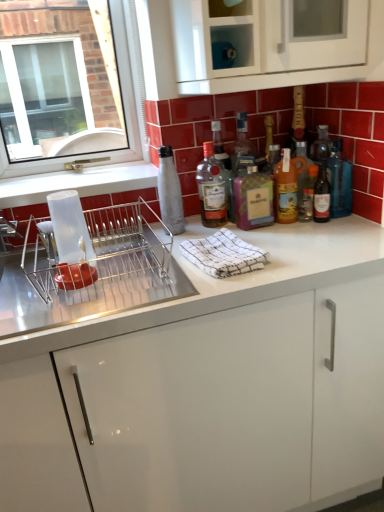
Describe the element at coordinates (223, 254) in the screenshot. This screenshot has height=512, width=384. I see `white textured cloth at center` at that location.

At what (x,y) coordinates should I click in order to perform the action: click on matte glass wine bottle at center-right. Please return your answer as a coordinate pair (x, y). This screenshot has height=512, width=384. Looking at the image, I should click on (321, 196).

How much space does translucent amber bottle at center, which appears as the fourth bottle when viewed from the left, occupy vertically?

translucent amber bottle at center, which appears as the fourth bottle when viewed from the left, is 8.98 inches in height.

Where is `white textured cloth at center`? Image resolution: width=384 pixels, height=512 pixels. white textured cloth at center is located at coordinates (223, 254).

Could you tell me if matte glass bottle at center, the 2th bottle positioned from the left, is turned towards matte glass bottle at center, the 3th bottle in the left-to-right sequence?

No, matte glass bottle at center, the 2th bottle positioned from the left, does not turn towards matte glass bottle at center, the 3th bottle in the left-to-right sequence.

Is matte glass bottle at center, the 2th bottle positioned from the left, closer to the viewer compared to matte glass bottle at center, the 4th bottle when ordered from right to left?

No.

How different are the orientations of matte glass bottle at center, the 2th bottle positioned from the left, and matte glass bottle at center, the 3th bottle in the left-to-right sequence, in degrees?

The angle between the facing direction of matte glass bottle at center, the 2th bottle positioned from the left, and the facing direction of matte glass bottle at center, the 3th bottle in the left-to-right sequence, is 0.00259 degrees.

Is matte glass bottle at center, acting as the 5th bottle starting from the right, not inside matte glass bottle at center, the 4th bottle when ordered from right to left?

Yes.

Between white glossy cabinet at upper center, placed as the 1th cabinetry when sorted from top to bottom, and matte glass bottle at center, the 3th bottle in the left-to-right sequence, which one appears on the left side from the viewer's perspective?

From the viewer's perspective, matte glass bottle at center, the 3th bottle in the left-to-right sequence, appears more on the left side.

Considering the sizes of objects white glossy cabinet at upper center, the 2th cabinetry ordered from the bottom, and matte glass bottle at center, the 4th bottle when ordered from right to left, in the image provided, who is shorter, white glossy cabinet at upper center, the 2th cabinetry ordered from the bottom, or matte glass bottle at center, the 4th bottle when ordered from right to left,?

Standing shorter between the two is matte glass bottle at center, the 4th bottle when ordered from right to left.

Is white glossy cabinet at upper center, placed as the 1th cabinetry when sorted from top to bottom, positioned behind matte glass bottle at center, the 4th bottle when ordered from right to left?

No.

From the picture: From a real-world perspective, does white glossy cabinet at upper center, the 2th cabinetry ordered from the bottom, stand above matte glass bottle at center, the 3th bottle in the left-to-right sequence?

Indeed, from a real-world perspective, white glossy cabinet at upper center, the 2th cabinetry ordered from the bottom, stands above matte glass bottle at center, the 3th bottle in the left-to-right sequence.

Does matte glass bottle at center, the 2th bottle positioned from the left, have a greater height compared to translucent glass bottles at center, the 2th bottle viewed from the right?

Yes.

Would you say matte glass bottle at center, acting as the 5th bottle starting from the right, is to the left or to the right of translucent glass bottles at center, the 5th bottle from the left, in the picture?

From the image, it's evident that matte glass bottle at center, acting as the 5th bottle starting from the right, is to the left of translucent glass bottles at center, the 5th bottle from the left.

Find the location of a particular element. The width and height of the screenshot is (384, 512). bottle lying behind the matte glass bottle at center, the 2th bottle positioned from the left is located at coordinates (307, 193).

Between matte glass bottle at center, the 2th bottle positioned from the left, and translucent glass bottles at center, the 2th bottle viewed from the right, which one has larger width?

matte glass bottle at center, the 2th bottle positioned from the left.

Does metallic silver dish rack at left turn towards white glossy window sill at upper left?

No, metallic silver dish rack at left is not aimed at white glossy window sill at upper left.

Which of these two, metallic silver dish rack at left or white glossy window sill at upper left, stands taller?

metallic silver dish rack at left is taller.

From the image's perspective, which one is positioned higher, metallic silver dish rack at left or white glossy window sill at upper left?

white glossy window sill at upper left appears higher in the image.

Is metallic silver dish rack at left far from white glossy window sill at upper left?

metallic silver dish rack at left is actually quite close to white glossy window sill at upper left.

From the image's perspective, would you say white glossy cabinet at upper center, the 2th cabinetry ordered from the bottom, is positioned over matte glass wine bottle at center-right?

Yes, from the image's perspective, white glossy cabinet at upper center, the 2th cabinetry ordered from the bottom, is over matte glass wine bottle at center-right.

Is white glossy cabinet at upper center, placed as the 1th cabinetry when sorted from top to bottom, to the left or to the right of matte glass wine bottle at center-right in the image?

white glossy cabinet at upper center, placed as the 1th cabinetry when sorted from top to bottom, is positioned on matte glass wine bottle at center-right's left side.

Find the location of a particular element. This screenshot has height=512, width=384. cabinetry above the matte glass wine bottle at center-right (from a real-world perspective) is located at coordinates (242, 77).

Would you say white glossy cabinet at upper center, the 2th cabinetry ordered from the bottom, is outside matte glass wine bottle at center-right?

Absolutely, white glossy cabinet at upper center, the 2th cabinetry ordered from the bottom, is external to matte glass wine bottle at center-right.

Between translucent glass bottles at center, the 2th bottle viewed from the right, and white glossy window sill at upper left, which one has less height?

With less height is white glossy window sill at upper left.

Is translucent glass bottles at center, the 2th bottle viewed from the right, looking in the opposite direction of white glossy window sill at upper left?

No, translucent glass bottles at center, the 2th bottle viewed from the right,'s orientation is not away from white glossy window sill at upper left.

Is translucent glass bottles at center, the 5th bottle from the left, next to white glossy window sill at upper left and touching it?

No, translucent glass bottles at center, the 5th bottle from the left, is not with white glossy window sill at upper left.

From the picture: From a real-world perspective, is translucent glass bottles at center, the 2th bottle viewed from the right, positioned under white glossy window sill at upper left based on gravity?

Correct, in the physical world, translucent glass bottles at center, the 2th bottle viewed from the right, is lower than white glossy window sill at upper left.

Is white glass bottle at center, the 6th bottle in the right-to-left sequence, completely or partially inside white textured cloth at center?

No, white glass bottle at center, the 6th bottle in the right-to-left sequence, is not surrounded by white textured cloth at center.

Consider the image. Which of these two, white textured cloth at center or white glass bottle at center, which is the first bottle in left-to-right order, is smaller?

white glass bottle at center, which is the first bottle in left-to-right order, is smaller.

Locate an element on the screen. material to the right of white glass bottle at center, the 6th bottle in the right-to-left sequence is located at coordinates (223, 254).

Locate an element on the screen. bottle that is the 3rd object directly below the matte glass bottle at center, acting as the 5th bottle starting from the right (from a real-world perspective) is located at coordinates (253, 199).

This screenshot has width=384, height=512. Find the location of `the 1st bottle counting from the left side of the white glossy cabinet at upper center, placed as the 1th cabinetry when sorted from top to bottom`. the 1st bottle counting from the left side of the white glossy cabinet at upper center, placed as the 1th cabinetry when sorted from top to bottom is located at coordinates (253, 199).

From the image, which object appears to be farther from translucent amber bottle at center, which appears as the fourth bottle when viewed from the left, translucent glass bottles at center, the 2th bottle viewed from the right, or white glossy cabinet at upper center, placed as the 1th cabinetry when sorted from top to bottom?

white glossy cabinet at upper center, placed as the 1th cabinetry when sorted from top to bottom.

Estimate the real-world distances between objects in this image. Which object is further from translucent amber bottle at center, placed as the third bottle when sorted from right to left, white glossy cabinet at upper center, placed as the 1th cabinetry when sorted from top to bottom, or white glossy cabinet at center, arranged as the first cabinetry when ordered from the bottom?

white glossy cabinet at center, arranged as the first cabinetry when ordered from the bottom.

Based on their spatial positions, is translucent glass bottles at center, the 2th bottle viewed from the right, or white glossy window sill at upper left closer to matte glass bottle at center, the 2th bottle positioned from the left?

Based on the image, translucent glass bottles at center, the 2th bottle viewed from the right, appears to be nearer to matte glass bottle at center, the 2th bottle positioned from the left.

Based on their spatial positions, is white glossy cabinet at upper center, placed as the 1th cabinetry when sorted from top to bottom, or white glossy window sill at upper left further from metallic silver dish rack at left?

Based on the image, white glossy cabinet at upper center, placed as the 1th cabinetry when sorted from top to bottom, appears to be further to metallic silver dish rack at left.

Based on their spatial positions, is matte glass wine bottle at center-right or white glass bottle at center, the 6th bottle in the right-to-left sequence, further from white textured cloth at center?

matte glass wine bottle at center-right lies further to white textured cloth at center than the other object.

Which object lies further to the anchor point metallic silver dish rack at left, matte glass bottle at center, the 4th bottle when ordered from right to left, or white glossy cabinet at center, arranged as the second cabinetry when viewed from the top?

A: Based on the image, matte glass bottle at center, the 4th bottle when ordered from right to left, appears to be further to metallic silver dish rack at left.

Estimate the real-world distances between objects in this image. Which object is further from white glossy cabinet at center, arranged as the second cabinetry when viewed from the top, white glossy window sill at upper left or white glossy cabinet at upper center, placed as the 1th cabinetry when sorted from top to bottom?

white glossy cabinet at upper center, placed as the 1th cabinetry when sorted from top to bottom.

Estimate the real-world distances between objects in this image. Which object is closer to translucent glass bottles at center, the 2th bottle viewed from the right, translucent glass bottle at right, the 1th bottle when ordered from right to left, or metallic silver dish rack at left?

Based on the image, translucent glass bottle at right, the 1th bottle when ordered from right to left, appears to be nearer to translucent glass bottles at center, the 2th bottle viewed from the right.

You are a GUI agent. You are given a task and a screenshot of the screen. Output one action in this format:
    pyautogui.click(x=<x>, y=<y>)
    Task: Click on the wine bottle between translucent amber bottle at center, placed as the third bottle when sorted from right to left, and translucent glass bottle at right, the 1th bottle when ordered from right to left
    The width and height of the screenshot is (384, 512).
    Given the screenshot: What is the action you would take?
    pyautogui.click(x=321, y=196)

Image resolution: width=384 pixels, height=512 pixels. What are the coordinates of `material between matte glass bottle at center, the 3th bottle in the left-to-right sequence, and white glossy cabinet at center, arranged as the second cabinetry when viewed from the top, in the up-down direction` in the screenshot? It's located at (223, 254).

Identify the location of wine bottle located between matte glass bottle at center, the 3th bottle in the left-to-right sequence, and translucent glass bottle at right, the 1th bottle when ordered from right to left, in the left-right direction. click(321, 196).

I want to click on bottle between white glossy window sill at upper left and white textured cloth at center in the horizontal direction, so (x=170, y=192).